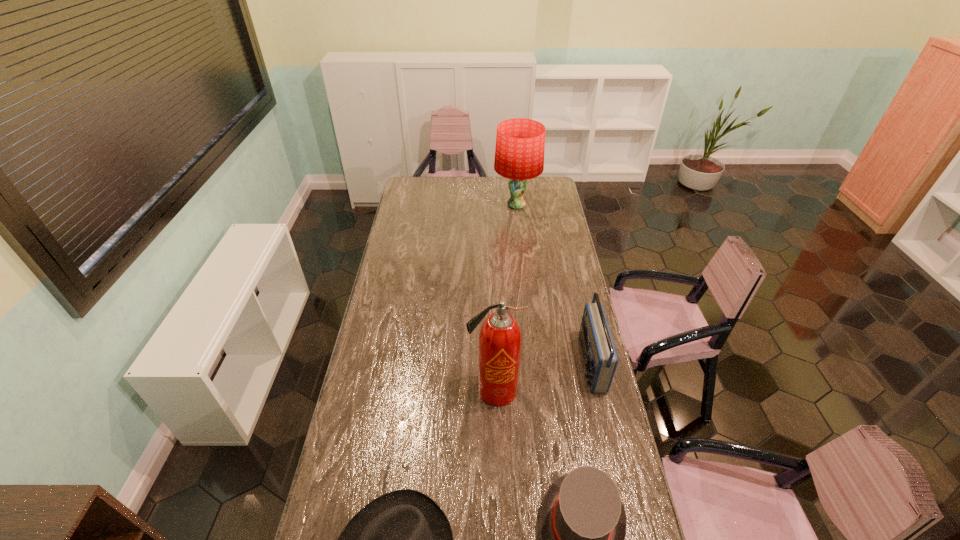
This screenshot has width=960, height=540. In order to click on object that is at the far edge in this screenshot , I will do `click(520, 143)`.

Locate an element on the screen. Image resolution: width=960 pixels, height=540 pixels. lampshade situated at the right edge is located at coordinates (520, 143).

Locate an element on the screen. The width and height of the screenshot is (960, 540). radio receiver at the right edge is located at coordinates (600, 358).

Image resolution: width=960 pixels, height=540 pixels. What are the coordinates of `object present at the far right corner` in the screenshot? It's located at (520, 143).

Image resolution: width=960 pixels, height=540 pixels. In the image, there is a desktop. In order to click on blank space at the far edge in this screenshot , I will do `click(497, 179)`.

Locate an element on the screen. The height and width of the screenshot is (540, 960). free location at the left edge is located at coordinates (392, 274).

At what (x,y) coordinates should I click in order to perform the action: click on vacant space at the right edge of the desktop. Please return your answer as a coordinate pair (x, y). The image size is (960, 540). Looking at the image, I should click on (539, 237).

The width and height of the screenshot is (960, 540). I want to click on free space at the far right corner, so click(x=555, y=178).

This screenshot has height=540, width=960. I want to click on free space between the fire extinguisher and the farthest object, so click(x=506, y=298).

Find the location of a particular element. The width and height of the screenshot is (960, 540). vacant point located between the fire extinguisher and the radio receiver is located at coordinates (542, 377).